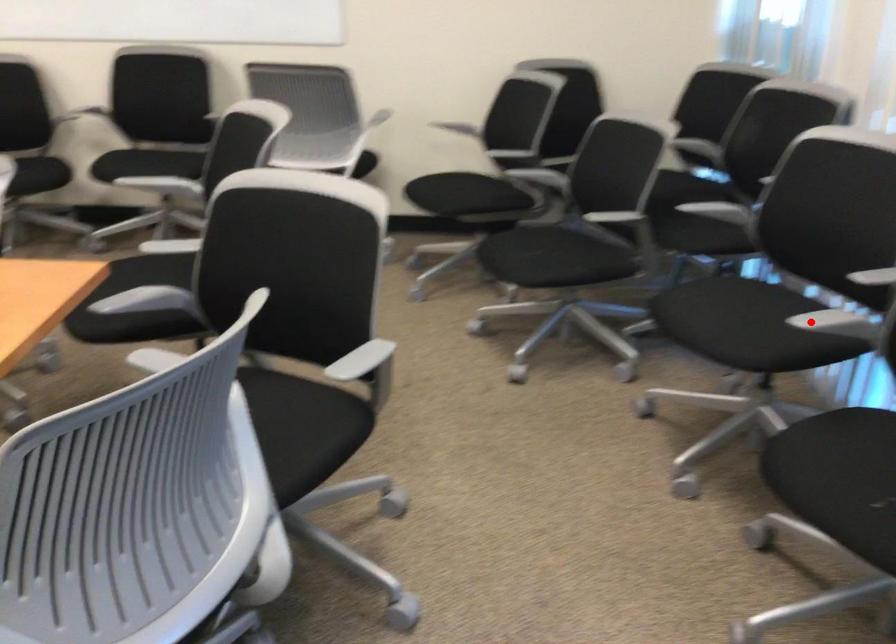
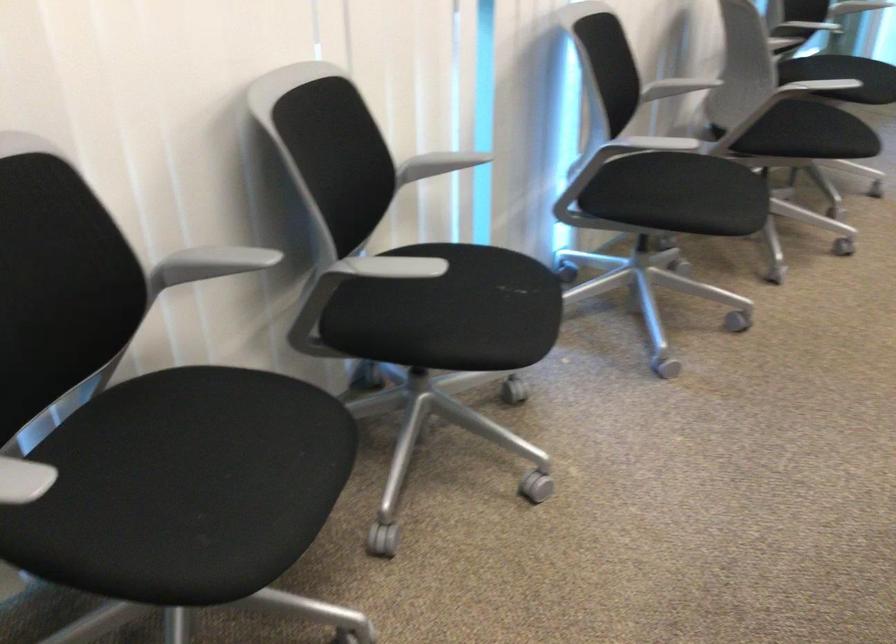
Question: A red point is marked in image1. In image2, is the corresponding 3D point closer to the camera or farther? Reply with the corresponding letter.

Choices:
 (A) The corresponding 3D point is closer.
 (B) The corresponding 3D point is farther.

Answer: (A)